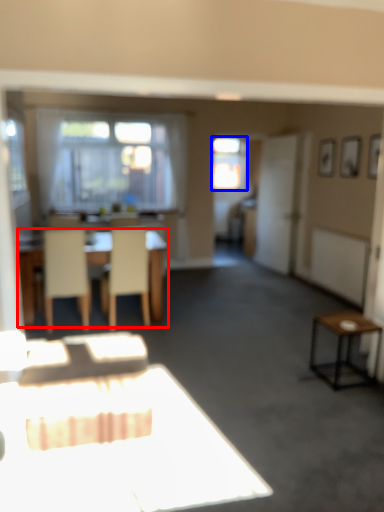
Question: Which point is closer to the camera, table (highlighted by a red box) or window (highlighted by a blue box)?

Choices:
 (A) table
 (B) window

Answer: (A)